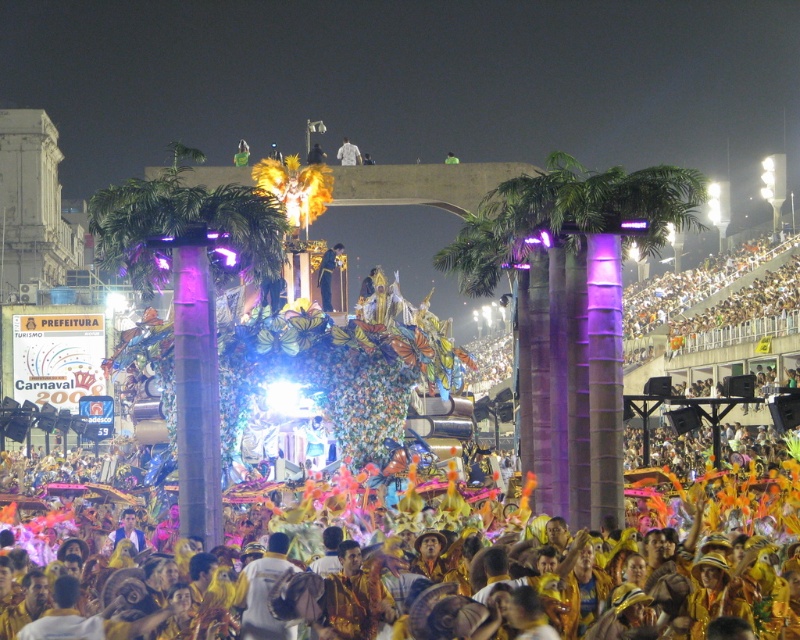
Question: Is green leafy palm at center positioned behind purple metallic palm tree at center?

Choices:
 (A) yes
 (B) no

Answer: (B)

Question: Observing the image, what is the correct spatial positioning of purple metallic palm tree at center in reference to white fabric at center?

Choices:
 (A) left
 (B) right

Answer: (A)

Question: Which point is closer to the camera?

Choices:
 (A) purple metallic palm tree at center
 (B) green leafy palm at center

Answer: (B)

Question: Which point is farther to the camera?

Choices:
 (A) (176, 170)
 (B) (344, 147)

Answer: (B)

Question: Estimate the real-world distances between objects in this image. Which object is farther from the green leafy palm at center?

Choices:
 (A) white fabric at center
 (B) purple metallic palm tree at center

Answer: (A)

Question: Is purple metallic palm tree at center thinner than white fabric at center?

Choices:
 (A) yes
 (B) no

Answer: (B)